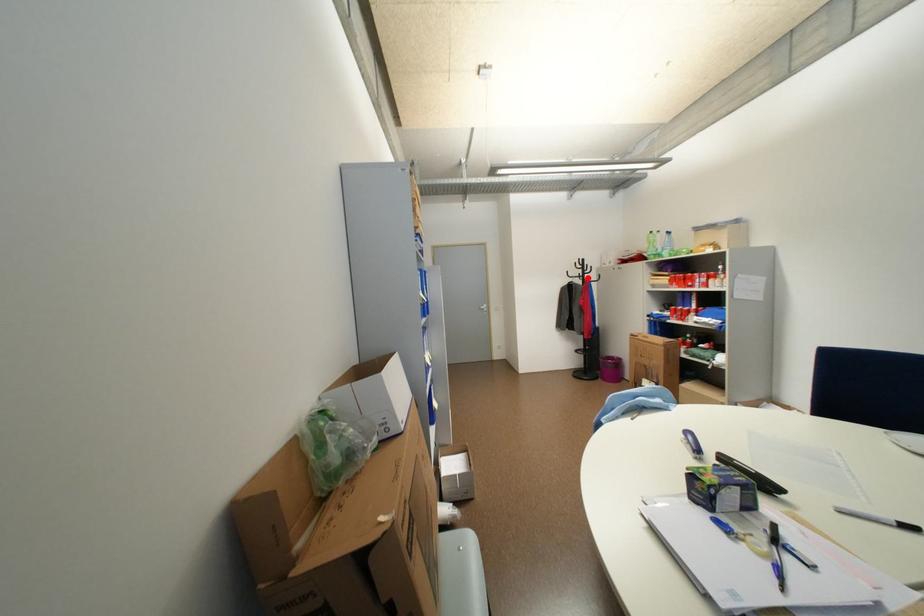
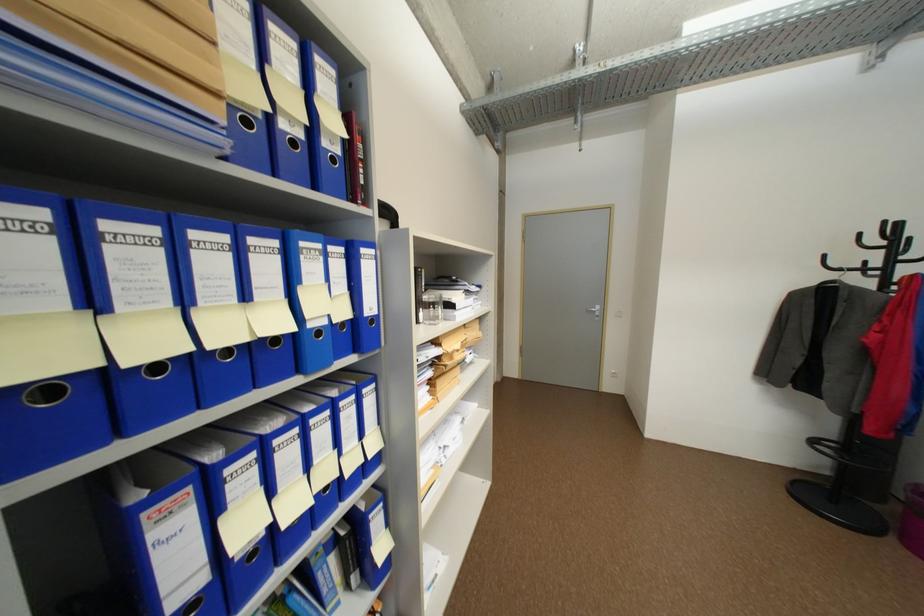
Where in the second image is the point corresponding to the highlighted location from the first image?

(873, 270)